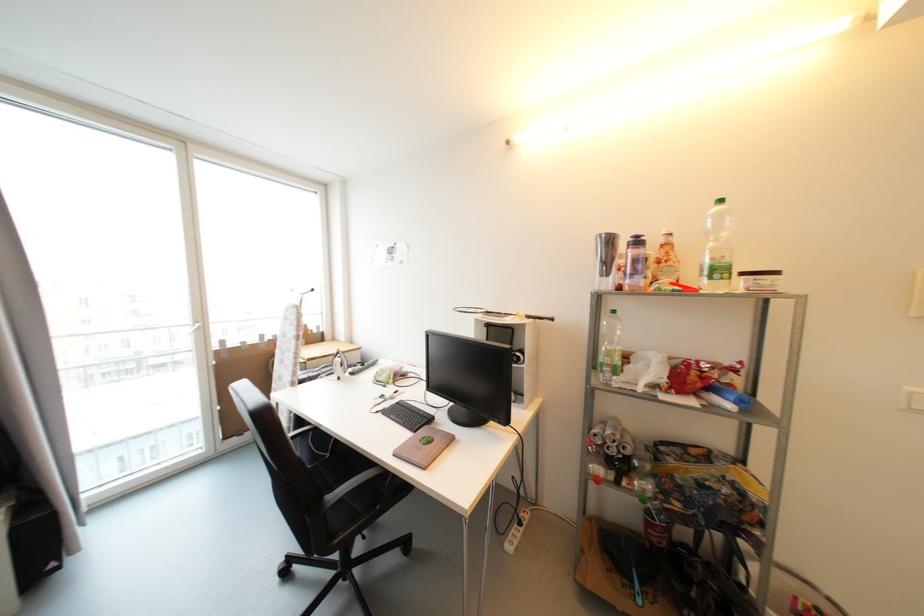
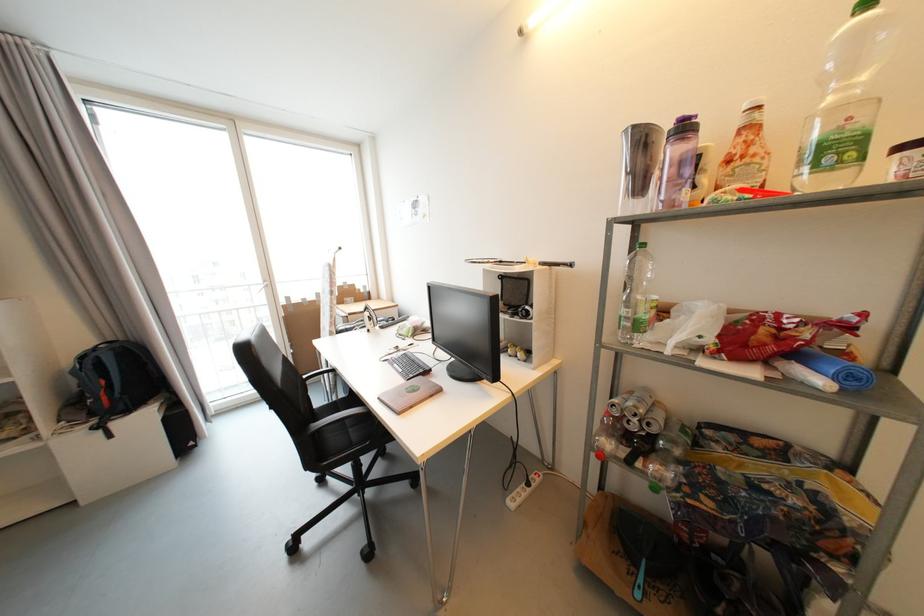
Question: The images are taken continuously from a first-person perspective. In which direction is your viewpoint rotating?

Choices:
 (A) Left
 (B) Right
 (C) Up
 (D) Down

Answer: (A)